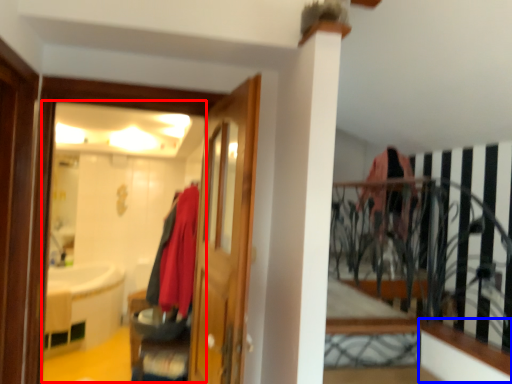
Question: Among these objects, which one is nearest to the camera, mirror (highlighted by a red box) or ledge (highlighted by a blue box)?

Choices:
 (A) mirror
 (B) ledge

Answer: (A)